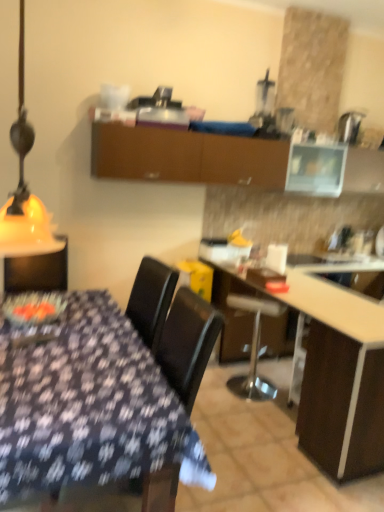
Locate an element on the screen. empty space that is to the right of black matte chair at center is located at coordinates point(244,482).